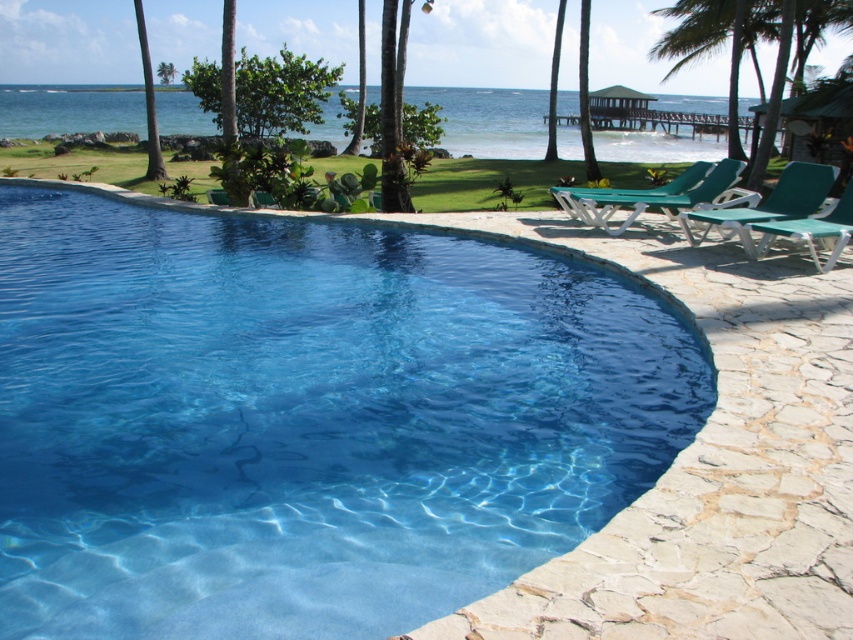
Question: Does transparent glass pool at center have a smaller size compared to green plastic beach chair at right?

Choices:
 (A) no
 (B) yes

Answer: (B)

Question: Which point is farther to the camera?

Choices:
 (A) (335, 500)
 (B) (177, 70)
 (C) (722, 220)
 (D) (657, 10)

Answer: (B)

Question: Can you confirm if green plastic beach chair at right is positioned below green leafy palm tree at upper left?

Choices:
 (A) yes
 (B) no

Answer: (A)

Question: Which of these objects is positioned farthest from the green leafy palm tree at upper right?

Choices:
 (A) green plastic beach chair at right
 (B) green leafy palm tree at upper left

Answer: (B)

Question: Which point is farther from the camera taking this photo?

Choices:
 (A) click(x=125, y=634)
 (B) click(x=828, y=256)
 (C) click(x=724, y=188)
 (D) click(x=798, y=188)

Answer: (C)

Question: Is green plastic beach chair at right smaller than green fabric beach chair at right?

Choices:
 (A) yes
 (B) no

Answer: (B)